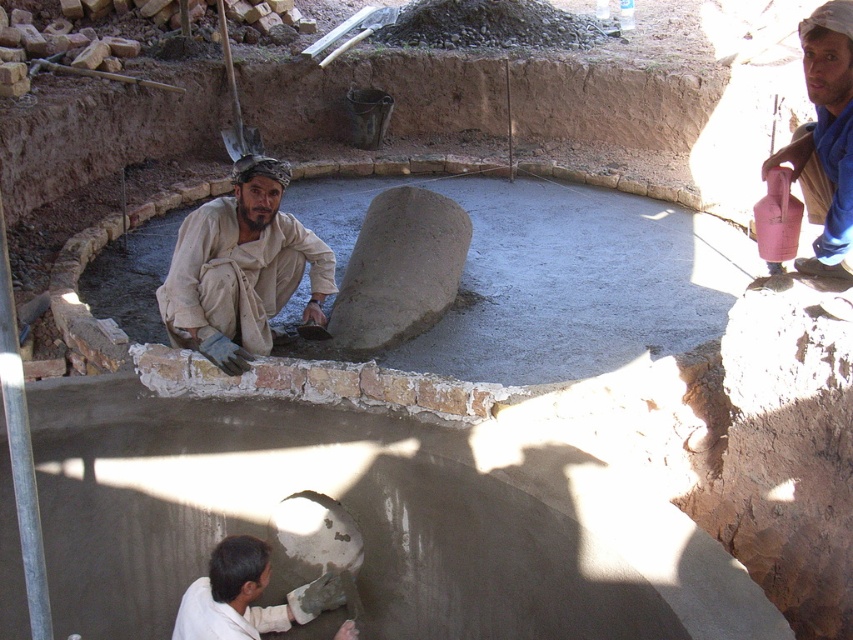
Between beige fabric pants at lower left and blue fabric water can at upper right, which one is positioned lower?

Positioned lower is beige fabric pants at lower left.

Can you confirm if beige fabric pants at lower left is bigger than blue fabric water can at upper right?

Indeed, beige fabric pants at lower left has a larger size compared to blue fabric water can at upper right.

Does point (267, 161) lie in front of point (825, 104)?

No, (267, 161) is further to viewer.

Locate an element on the screen. The width and height of the screenshot is (853, 640). beige fabric pants at lower left is located at coordinates (241, 269).

Between blue fabric water can at upper right and white matte trowel at lower center, which one is positioned lower?

white matte trowel at lower center is below.

Is blue fabric water can at upper right to the left of white matte trowel at lower center from the viewer's perspective?

No, blue fabric water can at upper right is not to the left of white matte trowel at lower center.

Which is in front, point (850, 6) or point (219, 625)?

Point (219, 625) is in front.

Locate an element on the screen. blue fabric water can at upper right is located at coordinates (825, 138).

Consider the image. Can you confirm if beige fabric pants at lower left is taller than white matte trowel at lower center?

Indeed, beige fabric pants at lower left has a greater height compared to white matte trowel at lower center.

Does point (291, 269) come behind point (337, 632)?

Yes.

Identify the location of beige fabric pants at lower left. This screenshot has height=640, width=853. (241, 269).